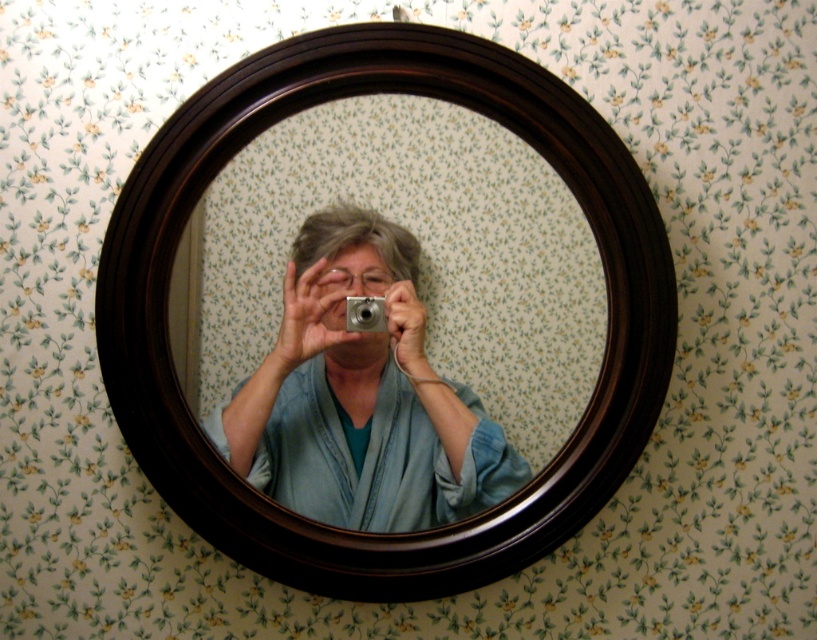
Is dark wood mirror at center to the left of blue fabric at center from the viewer's perspective?

Incorrect, dark wood mirror at center is not on the left side of blue fabric at center.

Which of these two, dark wood mirror at center or blue fabric at center, stands shorter?

blue fabric at center

Does point (659, 394) come behind point (443, 481)?

That is False.

At what (x,y) coordinates should I click in order to perform the action: click on dark wood mirror at center. Please return your answer as a coordinate pair (x, y). The width and height of the screenshot is (817, 640). Looking at the image, I should click on (213, 176).

This screenshot has width=817, height=640. What do you see at coordinates (360, 396) in the screenshot?
I see `blue fabric at center` at bounding box center [360, 396].

Which of these two, blue fabric at center or silver metallic camera at center, stands shorter?

With less height is silver metallic camera at center.

Who is more distant from viewer, (432,458) or (371,307)?

The point (432,458) is more distant.

Identify the location of blue fabric at center. (360, 396).

In the scene shown: Who is positioned more to the right, dark wood mirror at center or silver metallic camera at center?

From the viewer's perspective, dark wood mirror at center appears more on the right side.

Between dark wood mirror at center and silver metallic camera at center, which one appears on the left side from the viewer's perspective?

silver metallic camera at center is more to the left.

Describe the element at coordinates (213, 176) in the screenshot. I see `dark wood mirror at center` at that location.

The image size is (817, 640). What are the coordinates of `dark wood mirror at center` in the screenshot? It's located at (213, 176).